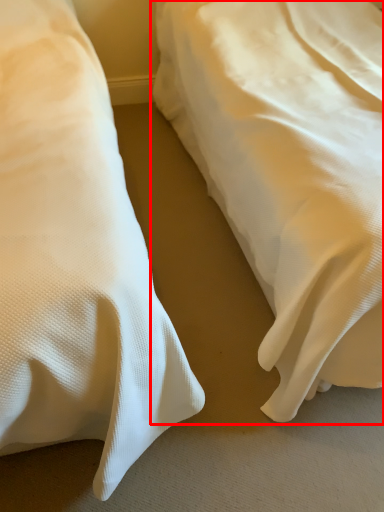
Question: Where is bed (annotated by the red box) located in relation to bed in the image?

Choices:
 (A) right
 (B) left

Answer: (A)